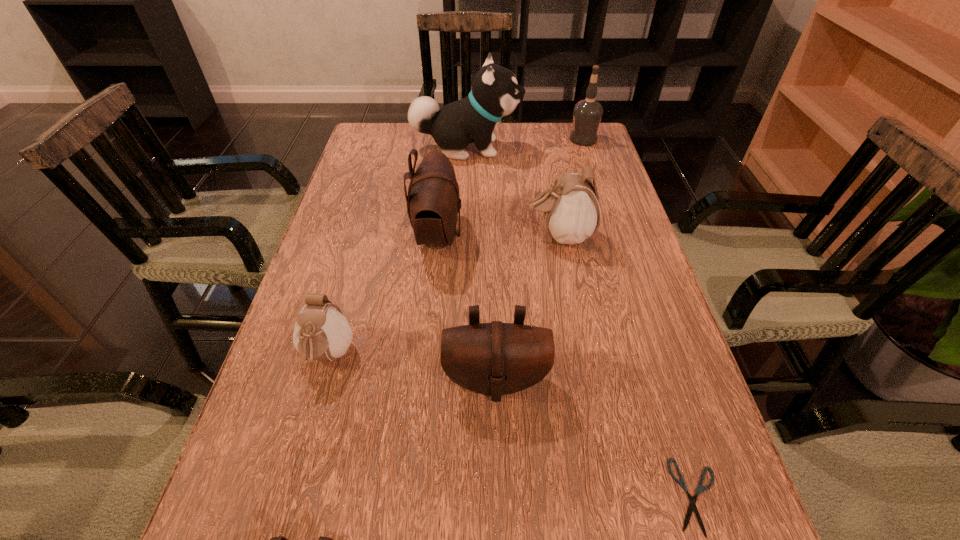
Find the location of a particular element. The height and width of the screenshot is (540, 960). white puppy is located at coordinates (495, 93).

Identify the location of vodka. (587, 114).

Where is `the biggest brown pouch`? The height and width of the screenshot is (540, 960). the biggest brown pouch is located at coordinates (433, 204).

The image size is (960, 540). What are the coordinates of `the bigger white pouch` in the screenshot? It's located at (571, 210).

Locate an element on the screen. The height and width of the screenshot is (540, 960). the farther white pouch is located at coordinates pos(571,210).

Identify the location of the second biggest brown pouch. (496, 358).

The image size is (960, 540). Identify the location of the left white pouch. pyautogui.click(x=321, y=332).

At what (x,y) coordinates should I click in order to perform the action: click on the smaller white pouch. Please return your answer as a coordinate pair (x, y). This screenshot has height=540, width=960. Looking at the image, I should click on (321, 332).

You are a GUI agent. You are given a task and a screenshot of the screen. Output one action in this format:
    pyautogui.click(x=<x>, y=<y>)
    Task: Click on the black shears
    This screenshot has height=540, width=960.
    Given the screenshot: What is the action you would take?
    pyautogui.click(x=692, y=505)

The height and width of the screenshot is (540, 960). I want to click on the seventh farthest object, so click(x=692, y=505).